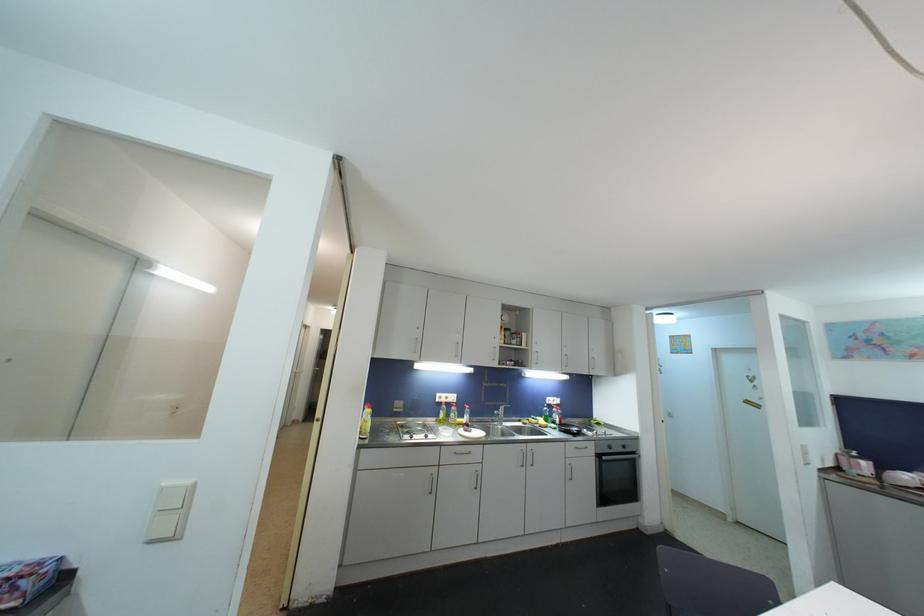
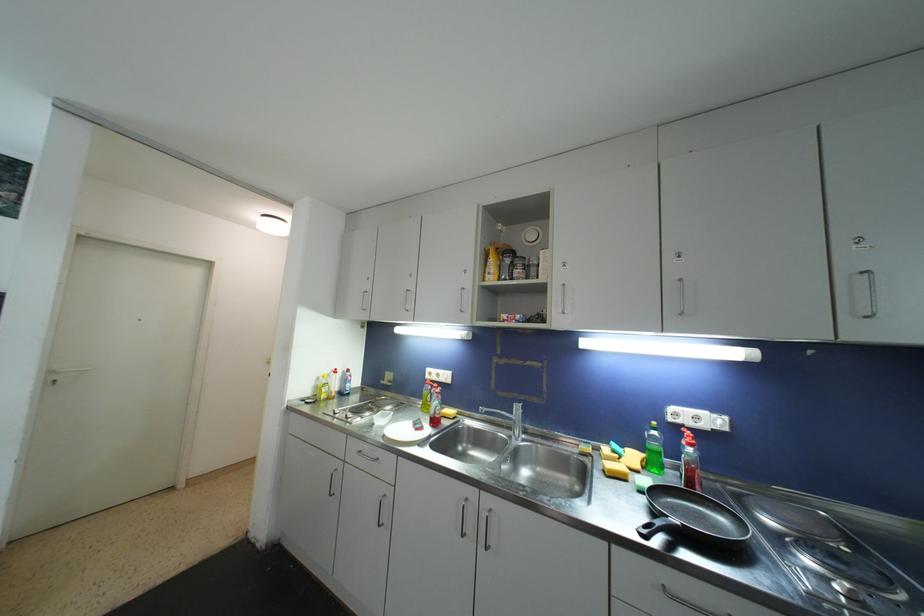
Locate, in the second image, the point that corresponds to [450,400] in the first image.

(441, 378)